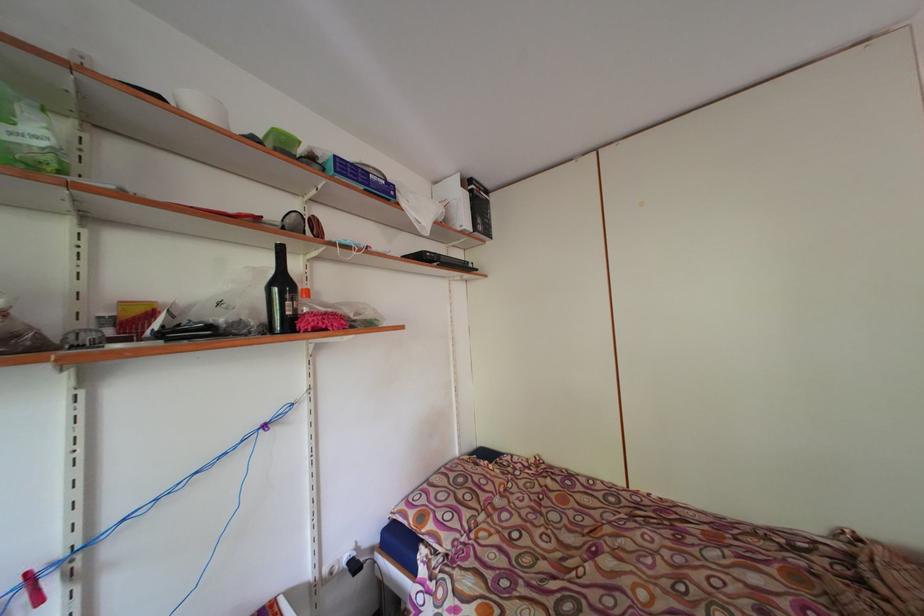
The location [359,177] corresponds to which object?

It refers to a blue cardboard box.